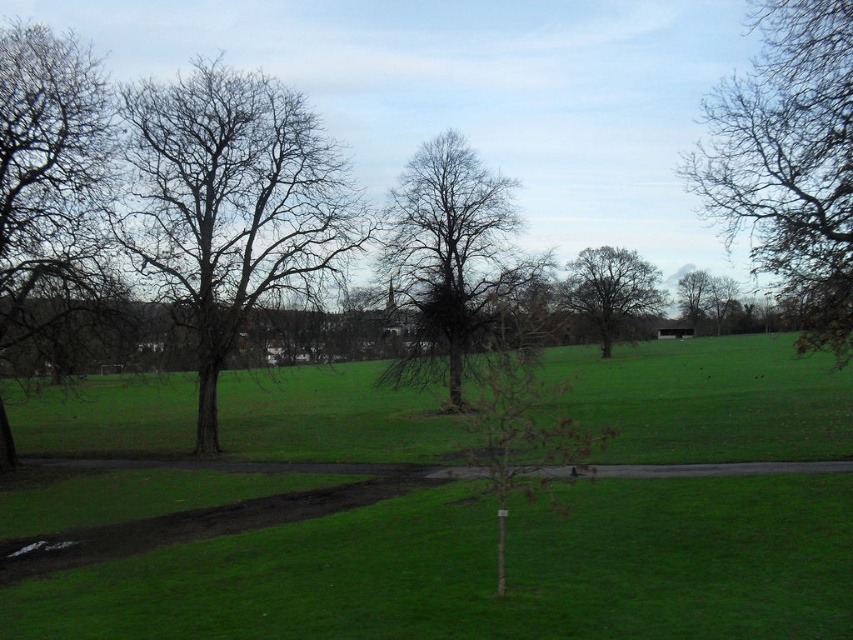
You are a park maintenance worker who needs to prune branches that are too wide to avoid blocking the pathway. Based on the image, which object should you prioritize pruning first, the bare branches at upper right or the brown leafless tree at center?

The brown leafless tree at center has a greater width than the bare branches at upper right, so you should prioritize pruning the brown leafless tree at center first to prevent blocking the pathway.

You are standing at the entrance of the park and want to reach the green grass at center. Which direction should you walk to get there?

The green grass at center is located at point 0.894 on the x and 0.574 on the y coordinates, so you should walk towards the center of the park to reach it.

You are a gardener planning to prune the bare branches at upper right and the brown leafless tree at center. Based on their positions, which object is closer to the right side of the scene?

The bare branches at upper right is closer to the right side of the scene as it is positioned to the right of the brown leafless tree at center.